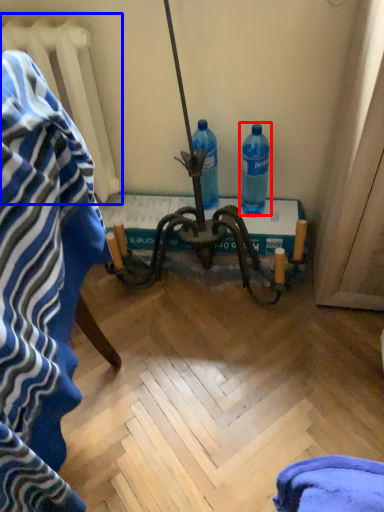
Question: Which point is closer to the camera, bottle (highlighted by a red box) or radiator (highlighted by a blue box)?

Choices:
 (A) bottle
 (B) radiator

Answer: (B)